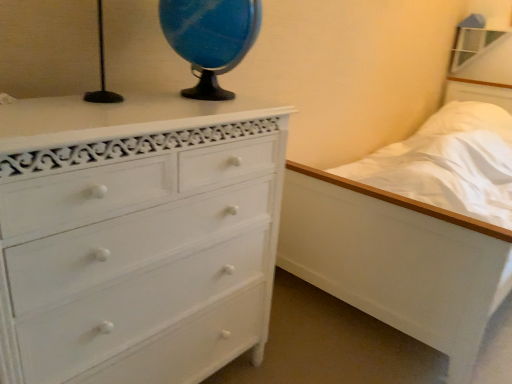
Question: Is blue marble globe at upper center in front of white painted wood chest of drawers at left?

Choices:
 (A) no
 (B) yes

Answer: (A)

Question: From a real-world perspective, is blue marble globe at upper center located higher than white painted wood chest of drawers at left?

Choices:
 (A) yes
 (B) no

Answer: (A)

Question: Considering the relative sizes of blue marble globe at upper center and white painted wood chest of drawers at left in the image provided, is blue marble globe at upper center wider than white painted wood chest of drawers at left?

Choices:
 (A) yes
 (B) no

Answer: (B)

Question: Considering the relative positions of blue marble globe at upper center and white painted wood chest of drawers at left in the image provided, is blue marble globe at upper center behind white painted wood chest of drawers at left?

Choices:
 (A) no
 (B) yes

Answer: (B)

Question: Can you confirm if blue marble globe at upper center is positioned to the left of white painted wood chest of drawers at left?

Choices:
 (A) yes
 (B) no

Answer: (B)

Question: From a real-world perspective, relative to white painted wood chest of drawers at left, is blue marble globe at upper center vertically above or below?

Choices:
 (A) above
 (B) below

Answer: (A)

Question: Considering the positions of point (210, 26) and point (45, 344), is point (210, 26) closer or farther from the camera than point (45, 344)?

Choices:
 (A) farther
 (B) closer

Answer: (A)

Question: Is blue marble globe at upper center taller or shorter than white painted wood chest of drawers at left?

Choices:
 (A) tall
 (B) short

Answer: (B)

Question: Considering the positions of blue marble globe at upper center and white painted wood chest of drawers at left in the image, is blue marble globe at upper center bigger or smaller than white painted wood chest of drawers at left?

Choices:
 (A) big
 (B) small

Answer: (B)

Question: Is white painted wood chest of drawers at left in front of or behind blue marble globe at upper center in the image?

Choices:
 (A) front
 (B) behind

Answer: (A)

Question: From the image's perspective, is white painted wood chest of drawers at left above or below blue marble globe at upper center?

Choices:
 (A) above
 (B) below

Answer: (B)

Question: Does point (245, 117) appear closer or farther from the camera than point (184, 29)?

Choices:
 (A) farther
 (B) closer

Answer: (B)

Question: Looking at their shapes, would you say white painted wood chest of drawers at left is wider or thinner than blue marble globe at upper center?

Choices:
 (A) thin
 (B) wide

Answer: (B)

Question: Does point (184, 273) appear closer or farther from the camera than point (356, 294)?

Choices:
 (A) farther
 (B) closer

Answer: (B)

Question: From the image's perspective, is white painted wood chest of drawers at left positioned above or below white wooden bed at right?

Choices:
 (A) below
 (B) above

Answer: (A)